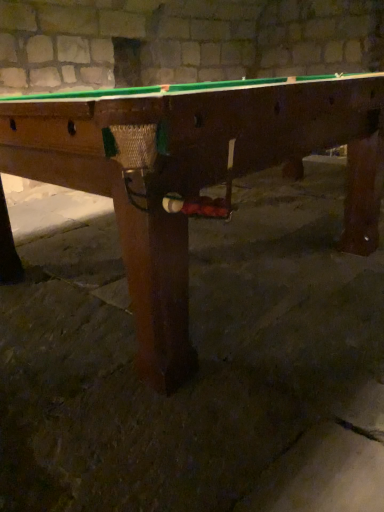
Describe the element at coordinates (192, 172) in the screenshot. I see `wooden pool table at center` at that location.

The width and height of the screenshot is (384, 512). Find the location of `wooden pool table at center`. wooden pool table at center is located at coordinates (192, 172).

I want to click on wooden pool table at center, so click(192, 172).